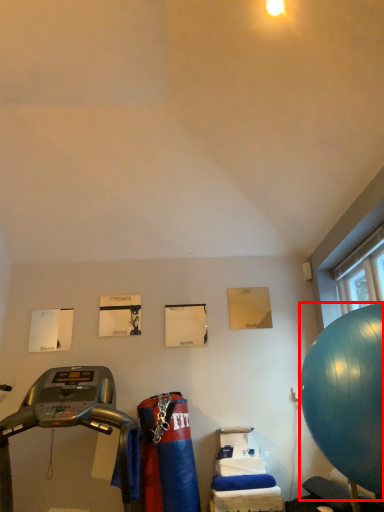
Question: From the image's perspective, what is the correct spatial relationship of ball (annotated by the red box) in relation to treadmill?

Choices:
 (A) below
 (B) above

Answer: (B)